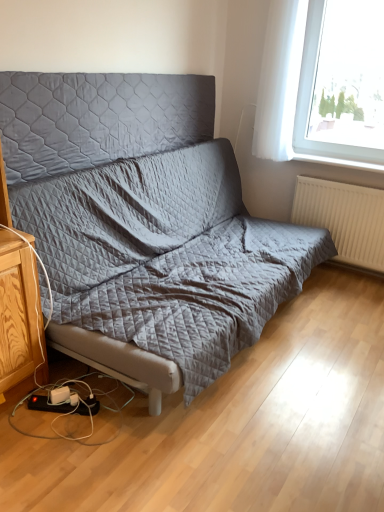
I want to click on vacant space situated above white textured radiator at right (from a real-world perspective), so click(347, 180).